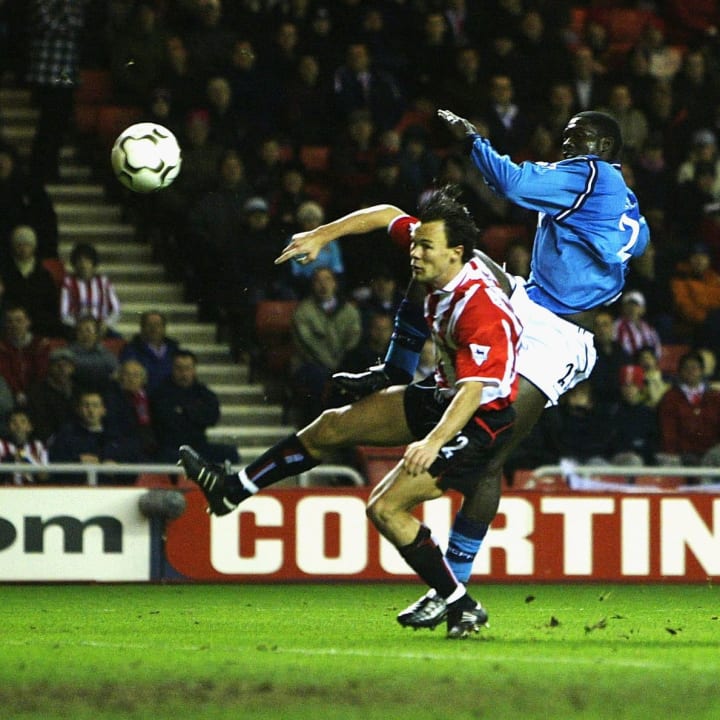
You are a GUI agent. You are given a task and a screenshot of the screen. Output one action in this format:
    pyautogui.click(x=<x>, y=<y>)
    Task: Click on the blue sock
    Image resolution: width=720 pixels, height=720 pixels.
    Given the screenshot: What is the action you would take?
    pyautogui.click(x=461, y=566)